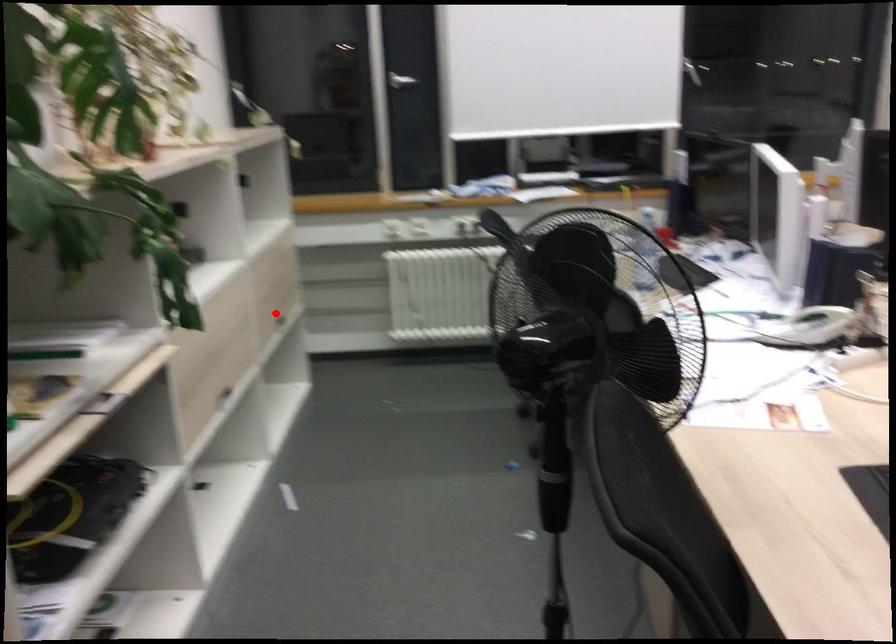
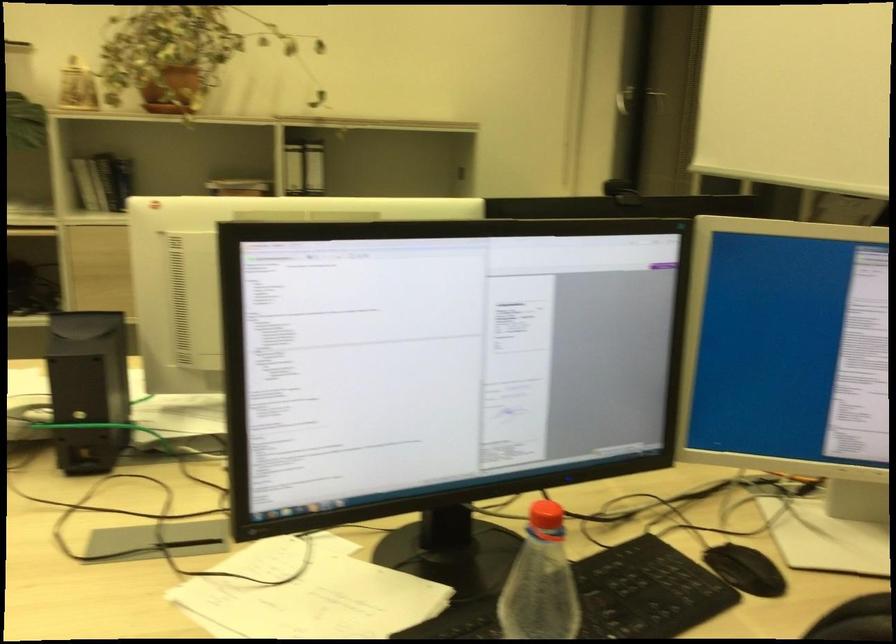
Question: I am providing you with two images of the same scene from different viewpoints. A red point is marked on the first image. Can you still see the location of the red point in image 2?

Choices:
 (A) Yes
 (B) No

Answer: (B)